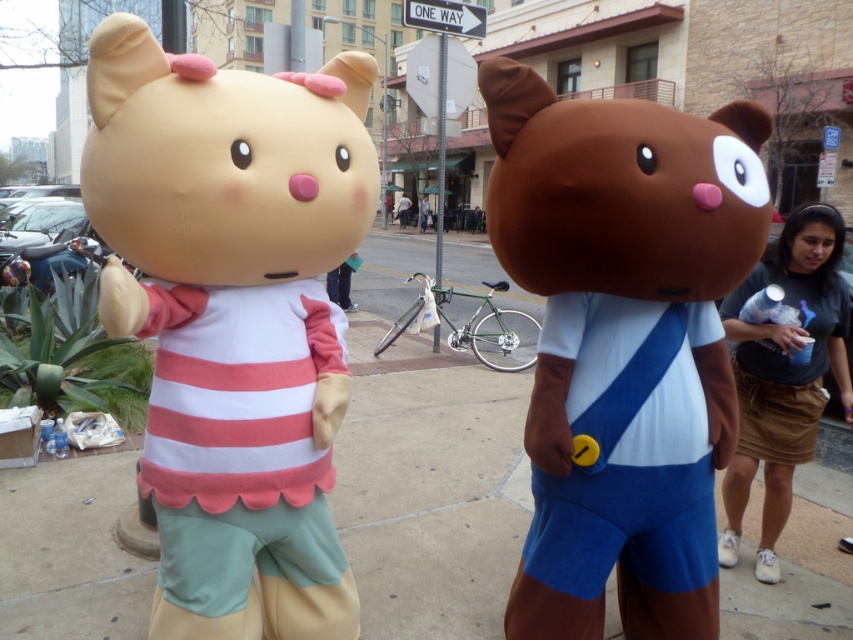
You are a photographer setting up for a photo shoot in the scene. You need to place a light source to the right of both the matte pink plush teddy bear at left and the brown cotton skirt at lower right. Is this possible given their positions?

The matte pink plush teddy bear at left is positioned on the left side of the brown cotton skirt at lower right. Since the bear is to the left of the skirt, placing a light source to the right of both would be possible as the skirt is already on the right side relative to the bear.

You are a delivery robot trying to navigate between the matte pink plush teddy bear at left and the white fabric shirt at center. Since you can only move straight ahead, will you collide with either object if you continue moving forward?

The matte pink plush teddy bear at left is to the right of the white fabric shirt at center, so if you move straight ahead, you might collide with the white fabric shirt at center first since it is closer to your path. However, the exact collision depends on your current position relative to both objects.

You are a delivery robot navigating the sidewalk in the image. You need to drop off a package to the matte pink plush teddy bear at left. According to the coordinates provided, where should you deliver the package?

The matte pink plush teddy bear at left is located at coordinates point (231, 317), so you should deliver the package to that position.